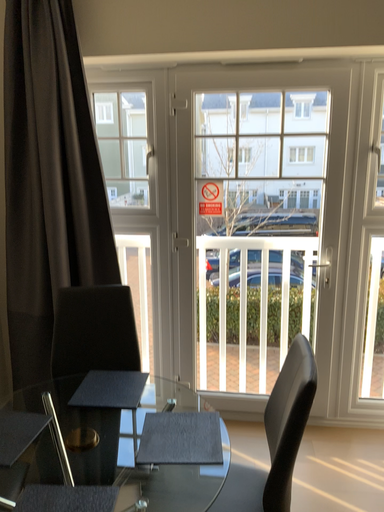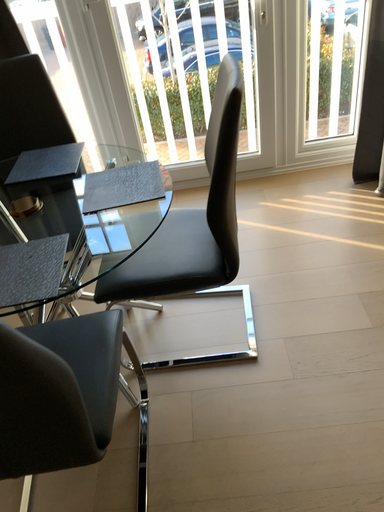
Question: Which way did the camera rotate in the video?

Choices:
 (A) rotated downward
 (B) rotated upward

Answer: (A)